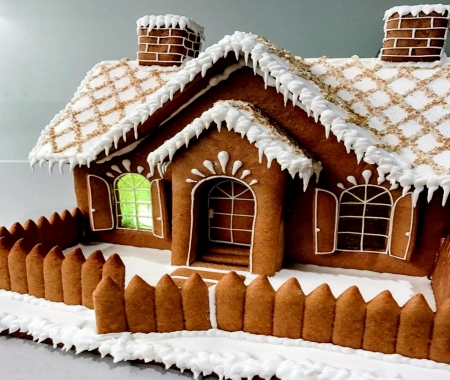
The image size is (450, 380). I want to click on chimneys, so click(181, 38), click(406, 41).